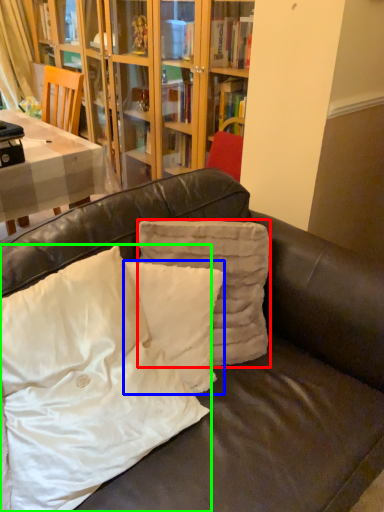
Question: Considering the real-world distances, which object is closest to pillow (highlighted by a red box)? pillow (highlighted by a blue box) or pillow (highlighted by a green box).

Choices:
 (A) pillow
 (B) pillow

Answer: (A)